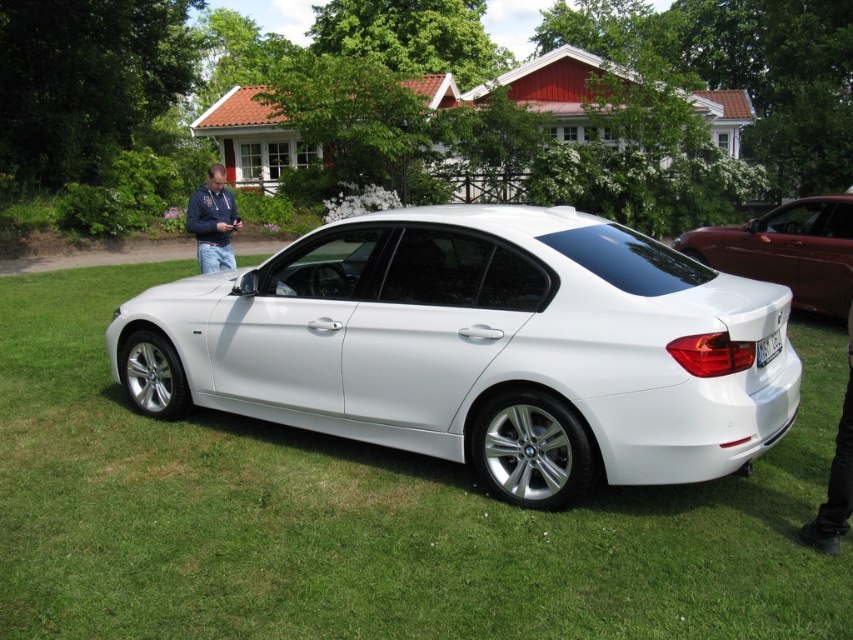
You are standing in front of the white BMW sedan parked on the grassy area. You notice two points marked on the car. The first point is at coordinate point (851,362) and the second is at point (219,236). If you were to reach out and touch both points, which one would require you to stretch your arm further?

The point at (219,236) would require you to stretch your arm further because it is farther from the camera compared to point (851,362).

You are standing at the edge of the grassy area and want to place a picnic blanket exactly where the green grass at center is located. According to the coordinates provided, where should you place the blanket?

You should place the picnic blanket at the coordinates point [364,515] where the green grass at center is located.

From the picture: You are standing in front of the white BMW sedan parked on the grassy area. You notice two points marked on the car. The first point is at coordinate point (x=426, y=547) and the second point is at coordinate point (x=229, y=225). Which point is closer to you?

Point (x=426, y=547) is closer to the camera than point (x=229, y=225), so the first point is closer to you.